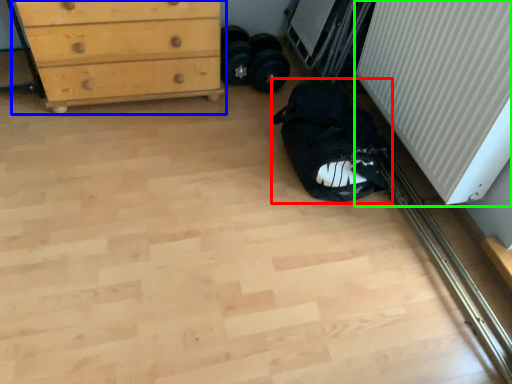
Question: Which is farther away from sleeping bag (highlighted by a red box)? chest of drawers (highlighted by a blue box) or radiator (highlighted by a green box)?

Choices:
 (A) chest of drawers
 (B) radiator

Answer: (A)